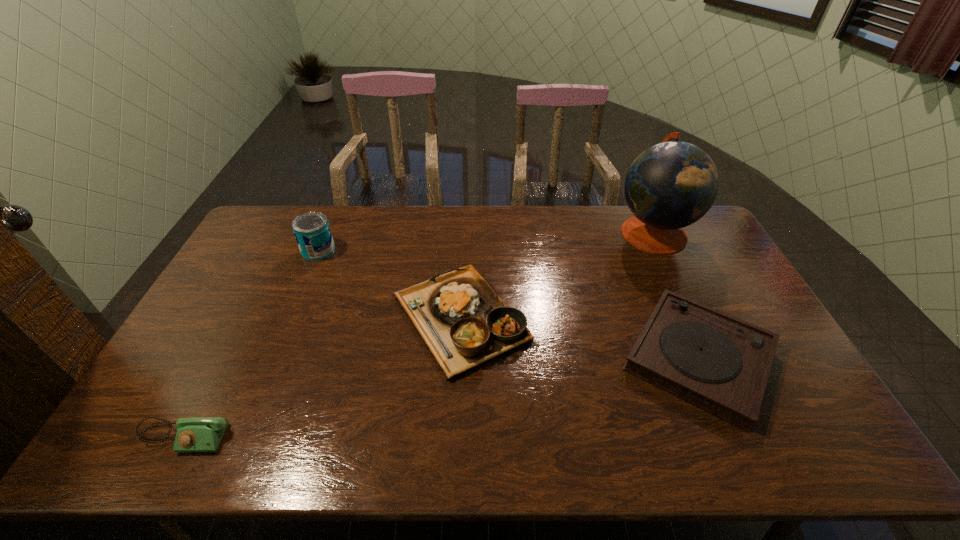
Where is `free location located 0.330m on the back of the platter`? The width and height of the screenshot is (960, 540). free location located 0.330m on the back of the platter is located at coordinates (467, 211).

This screenshot has width=960, height=540. In order to click on vacant space located 0.400m on the left of the phonograph record in this screenshot , I will do `click(473, 358)`.

Find the location of a particular element. globe that is at the far edge is located at coordinates (671, 185).

This screenshot has height=540, width=960. In order to click on can located in the far edge section of the desktop in this screenshot , I will do `click(312, 231)`.

Identify the location of phonograph record located at the near edge. This screenshot has height=540, width=960. (716, 362).

Locate an element on the screen. telephone that is at the near edge is located at coordinates (193, 434).

Locate an element on the screen. The image size is (960, 540). object situated at the left edge is located at coordinates (193, 434).

Locate an element on the screen. This screenshot has width=960, height=540. globe located in the right edge section of the desktop is located at coordinates (671, 185).

At what (x,y) coordinates should I click in order to perform the action: click on phonograph record that is at the right edge. Please return your answer as a coordinate pair (x, y). This screenshot has height=540, width=960. Looking at the image, I should click on [716, 362].

Locate an element on the screen. object at the near left corner is located at coordinates (193, 434).